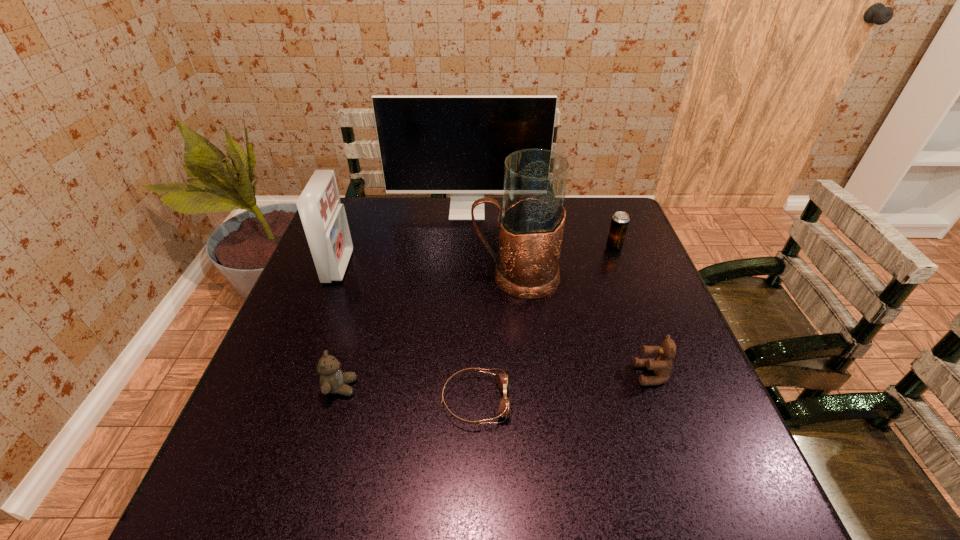
The width and height of the screenshot is (960, 540). What are the coordinates of `vacant area that lies between the right teddy bear and the beer can` in the screenshot? It's located at (633, 311).

Choose which object is the sixth nearest neighbor to the leftmost object. Please provide its 2D coordinates. Your answer should be formatted as a tuple, i.e. [(x, y)], where the tuple contains the x and y coordinates of a point satisfying the conditions above.

[(662, 364)]

You are a GUI agent. You are given a task and a screenshot of the screen. Output one action in this format:
    pyautogui.click(x=<x>, y=<y>)
    Task: Click on the object that can be found as the second closest to the first-aid kit
    The height and width of the screenshot is (540, 960).
    Given the screenshot: What is the action you would take?
    pyautogui.click(x=332, y=379)

You are a GUI agent. You are given a task and a screenshot of the screen. Output one action in this format:
    pyautogui.click(x=<x>, y=<y>)
    Task: Click on the vacant position in the image that satisfies the following two spatial constraints: 1. on the front-facing side of the farthest object; 2. on the face of the left teddy bear
    This screenshot has width=960, height=540.
    Given the screenshot: What is the action you would take?
    pyautogui.click(x=460, y=387)

The image size is (960, 540). Identify the location of vacant space that satisfies the following two spatial constraints: 1. on the front-facing side of the farthest object; 2. on the face of the left teddy bear. (460, 387).